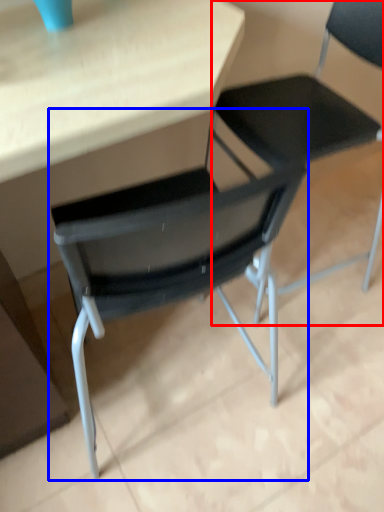
Question: Which point is further to the camera, chair (highlighted by a red box) or chair (highlighted by a blue box)?

Choices:
 (A) chair
 (B) chair

Answer: (B)